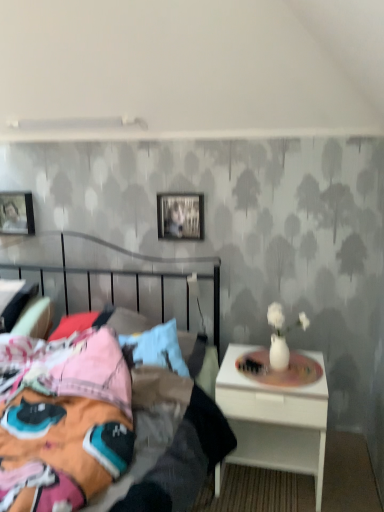
This screenshot has height=512, width=384. Identify the location of free spot above white glossy nightstand at right (from a real-world perspective). (275, 369).